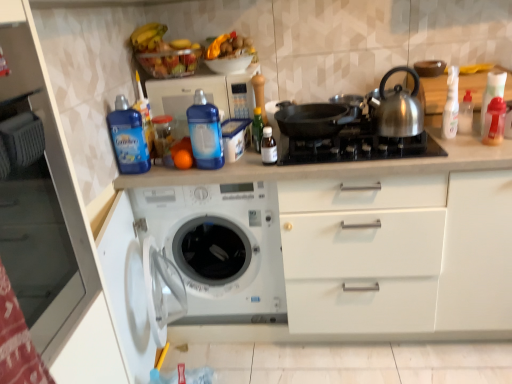
Question: Considering the positions of shiny metallic kettle at upper right and blue plastic microwave at upper center in the image, is shiny metallic kettle at upper right taller or shorter than blue plastic microwave at upper center?

Choices:
 (A) tall
 (B) short

Answer: (A)

Question: Is point (394, 129) positioned closer to the camera than point (164, 91)?

Choices:
 (A) closer
 (B) farther

Answer: (A)

Question: Which is nearer to the transparent plastic bottle at center, the 4th bottle in the right-to-left sequence?

Choices:
 (A) blue plastic bottle at upper left, placed as the 1th bottle when sorted from left to right
 (B) translucent plastic container at center, which is the 2th bottle from left to right
 (C) green glass bottle at center, the 5th bottle when ordered from right to left
 (D) blue plastic microwave at upper center
 (E) translucent plastic bottle at right, which is counted as the 8th bottle, starting from the left

Answer: (C)

Question: Which object is positioned farthest from the white matte cabinet at left?

Choices:
 (A) black matte pan at center
 (B) orange matte at center
 (C) blue plastic microwave at upper center
 (D) shiny metallic kettle at upper right
 (E) white plastic washing machine at lower left

Answer: (D)